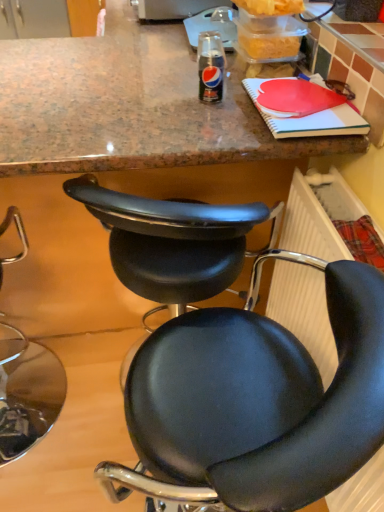
Identify the location of plastic radiator at lower right. (318, 215).

In order to click on black leather chair at lower left, arranged as the third chair when viewed from the right in this screenshot , I will do point(27,392).

Which object is closer to the camera taking this photo, plastic radiator at lower right or black leather chair at center, which ranks as the second chair in right-to-left order?

Positioned in front is plastic radiator at lower right.

Would you consider plastic radiator at lower right to be distant from black leather chair at center, which appears as the second chair when viewed from the left?

That's not correct — plastic radiator at lower right is a little close to black leather chair at center, which appears as the second chair when viewed from the left.

Is plastic radiator at lower right oriented away from black leather chair at center, which appears as the second chair when viewed from the left?

No, black leather chair at center, which appears as the second chair when viewed from the left, is not at the back of plastic radiator at lower right.

The width and height of the screenshot is (384, 512). What are the coordinates of `radiator below the black leather chair at lower left, arranged as the third chair when viewed from the right (from the image's perspective)` in the screenshot? It's located at (318, 215).

Could you tell me if black leather chair at lower left, arranged as the third chair when viewed from the right, is facing plastic radiator at lower right?

No, black leather chair at lower left, arranged as the third chair when viewed from the right, is not aimed at plastic radiator at lower right.

Considering the positions of objects black leather chair at lower left, acting as the 1th chair starting from the left, and plastic radiator at lower right in the image provided, who is more to the left, black leather chair at lower left, acting as the 1th chair starting from the left, or plastic radiator at lower right?

From the viewer's perspective, black leather chair at lower left, acting as the 1th chair starting from the left, appears more on the left side.

Considering the sizes of black leather chair at center, which ranks as the second chair in right-to-left order, and black leather chair at lower left, acting as the 1th chair starting from the left, in the image, is black leather chair at center, which ranks as the second chair in right-to-left order, wider or thinner than black leather chair at lower left, acting as the 1th chair starting from the left,?

black leather chair at center, which ranks as the second chair in right-to-left order, is thinner than black leather chair at lower left, acting as the 1th chair starting from the left.

Is the surface of black leather chair at center, which ranks as the second chair in right-to-left order, in direct contact with black leather chair at lower left, arranged as the third chair when viewed from the right?

No.

How many degrees apart are the facing directions of black leather chair at center, which ranks as the second chair in right-to-left order, and black leather chair at lower left, arranged as the third chair when viewed from the right?

The angular difference between black leather chair at center, which ranks as the second chair in right-to-left order, and black leather chair at lower left, arranged as the third chair when viewed from the right, is 1.23 degrees.

Which point is more forward, (260, 217) or (44, 361)?

The point (260, 217) is closer to the camera.

Considering the sizes of objects black leather chair at center, which ranks as the second chair in right-to-left order, and black leather chair at center, positioned as the third chair in left-to-right order, in the image provided, who is bigger, black leather chair at center, which ranks as the second chair in right-to-left order, or black leather chair at center, positioned as the third chair in left-to-right order,?

With larger size is black leather chair at center, positioned as the third chair in left-to-right order.

From a real-world perspective, is black leather chair at center, which appears as the second chair when viewed from the left, positioned above or below black leather chair at center, the first chair in the right-to-left sequence?

In terms of real-world spatial position, black leather chair at center, which appears as the second chair when viewed from the left, is below black leather chair at center, the first chair in the right-to-left sequence.

Starting from the black leather chair at center, positioned as the third chair in left-to-right order, which chair is the 2nd one behind? Please provide its 2D coordinates.

[(173, 241)]

Is black leather chair at lower left, acting as the 1th chair starting from the left, inside black leather chair at center, the first chair in the right-to-left sequence?

Definitely not — black leather chair at lower left, acting as the 1th chair starting from the left, is not inside black leather chair at center, the first chair in the right-to-left sequence.

Which object is closer to the camera, black leather chair at center, positioned as the third chair in left-to-right order, or black leather chair at lower left, arranged as the third chair when viewed from the right?

black leather chair at center, positioned as the third chair in left-to-right order, is in front.

Which object is thinner, black leather chair at center, positioned as the third chair in left-to-right order, or black leather chair at lower left, acting as the 1th chair starting from the left?

black leather chair at center, positioned as the third chair in left-to-right order, is thinner.

Which is closer, (x=362, y=416) or (x=51, y=401)?

The point (x=362, y=416) is in front.

Between black leather chair at center, the first chair in the right-to-left sequence, and black leather chair at center, which ranks as the second chair in right-to-left order, which one appears on the right side from the viewer's perspective?

From the viewer's perspective, black leather chair at center, the first chair in the right-to-left sequence, appears more on the right side.

Is black leather chair at center, positioned as the third chair in left-to-right order, not near black leather chair at center, which ranks as the second chair in right-to-left order?

No, black leather chair at center, positioned as the third chair in left-to-right order, is not far from black leather chair at center, which ranks as the second chair in right-to-left order.

Is black leather chair at center, the first chair in the right-to-left sequence, positioned with its back to black leather chair at center, which ranks as the second chair in right-to-left order?

No.

From the picture: Can we say black leather chair at center, positioned as the third chair in left-to-right order, lies outside black leather chair at center, which ranks as the second chair in right-to-left order?

Yes, black leather chair at center, positioned as the third chair in left-to-right order, is outside of black leather chair at center, which ranks as the second chair in right-to-left order.

I want to click on radiator lying behind the black leather chair at center, the first chair in the right-to-left sequence, so click(x=318, y=215).

Is black leather chair at center, the first chair in the right-to-left sequence, next to plastic radiator at lower right and touching it?

No, black leather chair at center, the first chair in the right-to-left sequence, is not touching plastic radiator at lower right.

Which of these two, black leather chair at center, the first chair in the right-to-left sequence, or plastic radiator at lower right, is smaller?

plastic radiator at lower right is smaller.

From the picture: From a real-world perspective, is black leather chair at center, the first chair in the right-to-left sequence, physically below plastic radiator at lower right?

Yes.

This screenshot has height=512, width=384. Find the location of `radiator below the black leather chair at center, which appears as the second chair when viewed from the left (from the image's perspective)`. radiator below the black leather chair at center, which appears as the second chair when viewed from the left (from the image's perspective) is located at coordinates (318, 215).

At what (x,y) coordinates should I click in order to perform the action: click on the 3rd chair counting from the left of the plastic radiator at lower right. Please return your answer as a coordinate pair (x, y). The image size is (384, 512). Looking at the image, I should click on (27, 392).

Based on their spatial positions, is plastic radiator at lower right or black leather chair at lower left, arranged as the third chair when viewed from the right, further from black leather chair at center, which appears as the second chair when viewed from the left?

black leather chair at lower left, arranged as the third chair when viewed from the right.

When comparing their distances from black leather chair at lower left, acting as the 1th chair starting from the left, does black leather chair at center, which appears as the second chair when viewed from the left, or plastic radiator at lower right seem further?

plastic radiator at lower right.

Based on their spatial positions, is black leather chair at center, which ranks as the second chair in right-to-left order, or black leather chair at lower left, acting as the 1th chair starting from the left, further from plastic radiator at lower right?

The object further to plastic radiator at lower right is black leather chair at lower left, acting as the 1th chair starting from the left.

Which object lies further to the anchor point black leather chair at center, which ranks as the second chair in right-to-left order, plastic radiator at lower right or black leather chair at center, positioned as the third chair in left-to-right order?

black leather chair at center, positioned as the third chair in left-to-right order, lies further to black leather chair at center, which ranks as the second chair in right-to-left order, than the other object.

From the image, which object appears to be farther from black leather chair at lower left, acting as the 1th chair starting from the left, plastic radiator at lower right or black leather chair at center, the first chair in the right-to-left sequence?

plastic radiator at lower right.

Which object lies nearer to the anchor point black leather chair at center, positioned as the third chair in left-to-right order, black leather chair at center, which appears as the second chair when viewed from the left, or plastic radiator at lower right?

The object closer to black leather chair at center, positioned as the third chair in left-to-right order, is plastic radiator at lower right.

From the image, which object appears to be farther from black leather chair at center, which ranks as the second chair in right-to-left order, black leather chair at lower left, arranged as the third chair when viewed from the right, or plastic radiator at lower right?

The object further to black leather chair at center, which ranks as the second chair in right-to-left order, is black leather chair at lower left, arranged as the third chair when viewed from the right.

Which object lies further to the anchor point black leather chair at center, positioned as the third chair in left-to-right order, plastic radiator at lower right or black leather chair at center, which ranks as the second chair in right-to-left order?

black leather chair at center, which ranks as the second chair in right-to-left order, is positioned further to the anchor black leather chair at center, positioned as the third chair in left-to-right order.

I want to click on chair between black leather chair at lower left, arranged as the third chair when viewed from the right, and black leather chair at center, positioned as the third chair in left-to-right order, from left to right, so click(173, 241).

The height and width of the screenshot is (512, 384). Identify the location of chair between black leather chair at center, which appears as the second chair when viewed from the left, and plastic radiator at lower right from left to right. (256, 401).